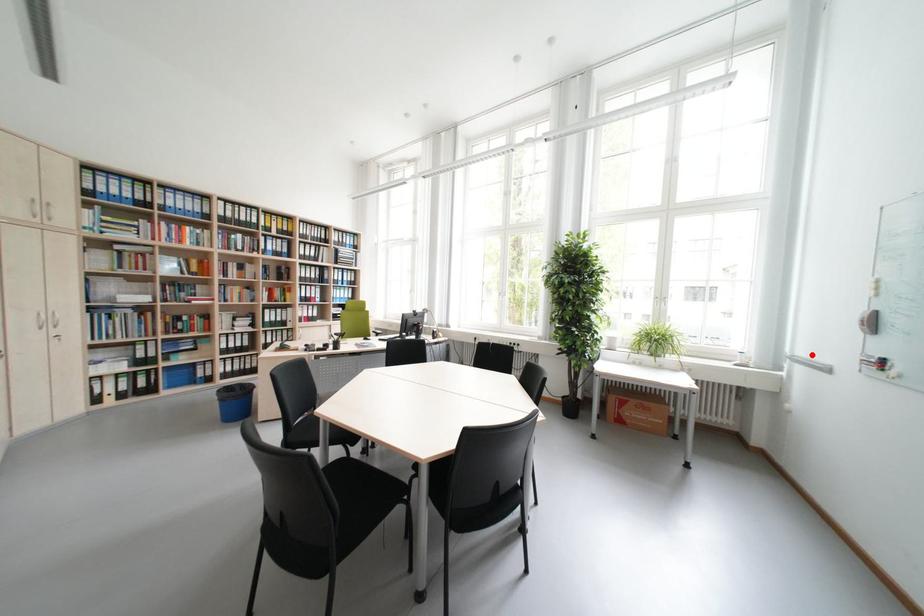
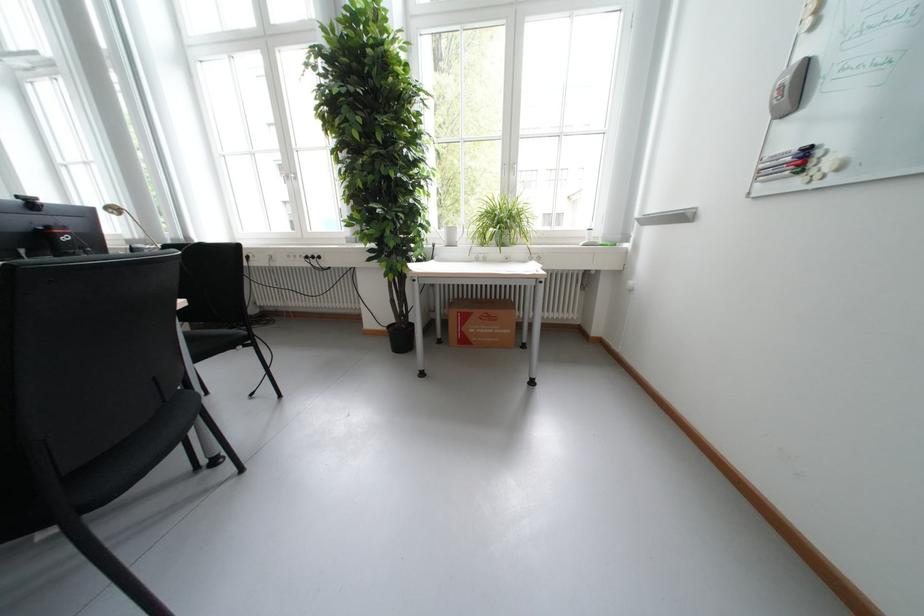
Question: I am providing you with two images of the same scene from different viewpoints. A red point is marked on the first image. At the location where the point appears in image 1, is it still visible in image 2?

Choices:
 (A) Yes
 (B) No

Answer: (A)